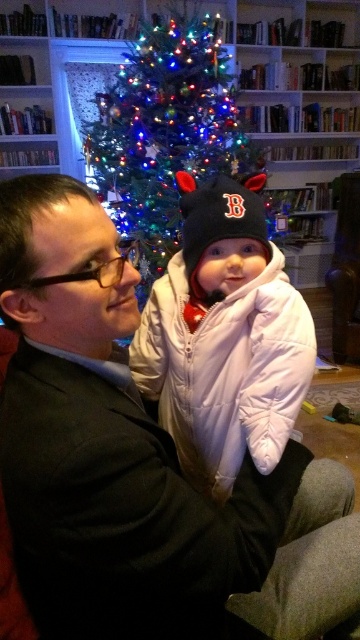
Does matte black suit at center appear on the left side of white puffy coat at center?

Correct, you'll find matte black suit at center to the left of white puffy coat at center.

Does matte black suit at center appear on the right side of white puffy coat at center?

Incorrect, matte black suit at center is not on the right side of white puffy coat at center.

What do you see at coordinates (140, 465) in the screenshot? The width and height of the screenshot is (360, 640). I see `matte black suit at center` at bounding box center [140, 465].

At what (x,y) coordinates should I click in order to perform the action: click on matte black suit at center. Please return your answer as a coordinate pair (x, y). Looking at the image, I should click on (140, 465).

Which is more to the right, matte black suit at center or green matte christmas tree at center?

From the viewer's perspective, matte black suit at center appears more on the right side.

Who is lower down, matte black suit at center or green matte christmas tree at center?

Positioned lower is matte black suit at center.

Find the location of a particular element. matte black suit at center is located at coordinates (140, 465).

Who is more distant from viewer, (11, 243) or (201, 234)?

Point (201, 234)

Can you confirm if matte black suit at center is positioned to the left of black knit hat at center?

Correct, you'll find matte black suit at center to the left of black knit hat at center.

Between point (83, 429) and point (180, 180), which one is positioned behind?

The point (180, 180) is behind.

Where is `matte black suit at center`? The width and height of the screenshot is (360, 640). matte black suit at center is located at coordinates (140, 465).